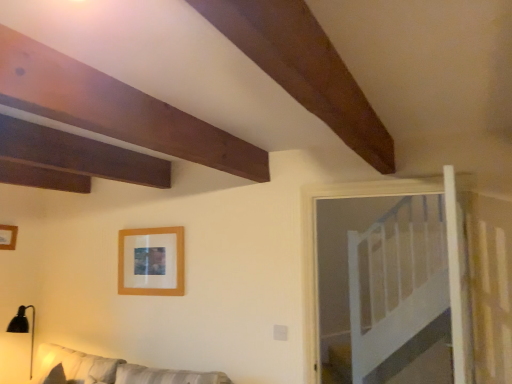
Question: Can we say wooden frame at upper left, the second picture frame positioned from the right, lies outside white wooden bed at upper right?

Choices:
 (A) yes
 (B) no

Answer: (A)

Question: From the image's perspective, is wooden frame at upper left, the second picture frame positioned from the right, beneath white wooden bed at upper right?

Choices:
 (A) no
 (B) yes

Answer: (A)

Question: Are wooden frame at upper left, arranged as the first picture frame when viewed from the left, and white wooden bed at upper right making contact?

Choices:
 (A) yes
 (B) no

Answer: (B)

Question: From a real-world perspective, is wooden frame at upper left, arranged as the first picture frame when viewed from the left, physically below white wooden bed at upper right?

Choices:
 (A) yes
 (B) no

Answer: (B)

Question: Is wooden frame at upper left, the second picture frame positioned from the right, far away from white wooden bed at upper right?

Choices:
 (A) no
 (B) yes

Answer: (B)

Question: Does wooden frame at upper left, arranged as the first picture frame when viewed from the left, appear on the right side of white wooden bed at upper right?

Choices:
 (A) yes
 (B) no

Answer: (B)

Question: Would you consider wooden frame at upper center, the 2th picture frame viewed from the left, to be distant from white wooden bed at upper right?

Choices:
 (A) yes
 (B) no

Answer: (A)

Question: From the image's perspective, is wooden frame at upper center, positioned as the first picture frame in right-to-left order, under white wooden bed at upper right?

Choices:
 (A) yes
 (B) no

Answer: (B)

Question: Considering the relative positions of wooden frame at upper center, the 2th picture frame viewed from the left, and white wooden bed at upper right in the image provided, is wooden frame at upper center, the 2th picture frame viewed from the left, to the right of white wooden bed at upper right from the viewer's perspective?

Choices:
 (A) no
 (B) yes

Answer: (A)

Question: From the image's perspective, is wooden frame at upper center, positioned as the first picture frame in right-to-left order, on top of white wooden bed at upper right?

Choices:
 (A) no
 (B) yes

Answer: (B)

Question: Is wooden frame at upper center, positioned as the first picture frame in right-to-left order, beside white wooden bed at upper right?

Choices:
 (A) yes
 (B) no

Answer: (B)

Question: Considering the relative sizes of wooden frame at upper center, positioned as the first picture frame in right-to-left order, and white wooden bed at upper right in the image provided, is wooden frame at upper center, positioned as the first picture frame in right-to-left order, thinner than white wooden bed at upper right?

Choices:
 (A) no
 (B) yes

Answer: (B)

Question: Does white fabric couch at lower left lie in front of white wooden bed at upper right?

Choices:
 (A) yes
 (B) no

Answer: (A)